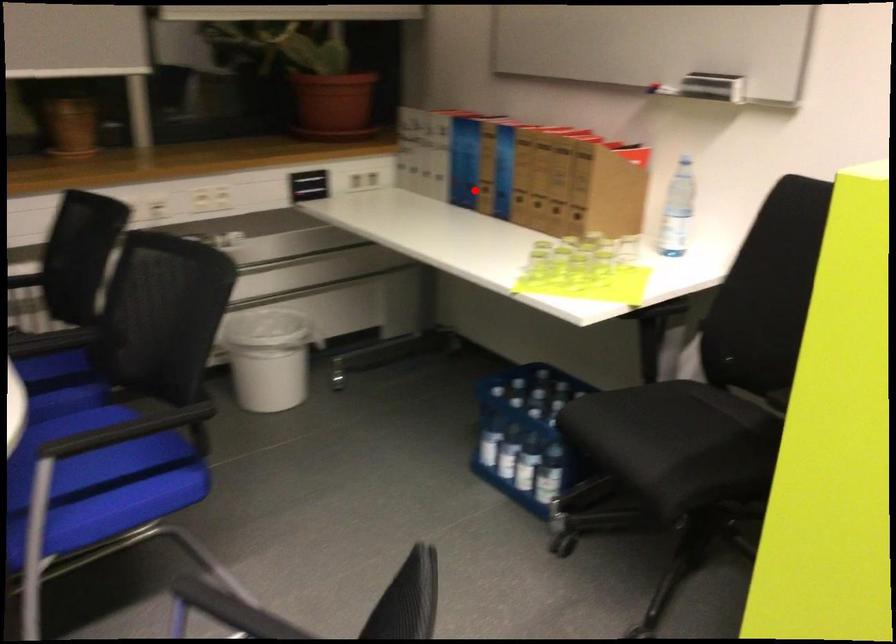
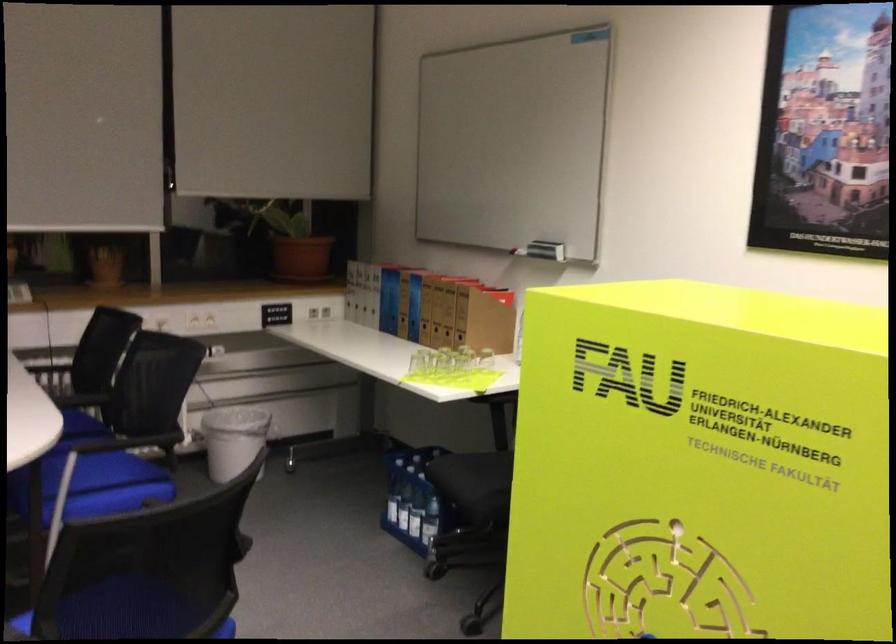
Locate, in the second image, the point that corresponds to the highlighted location in the first image.

(398, 317)